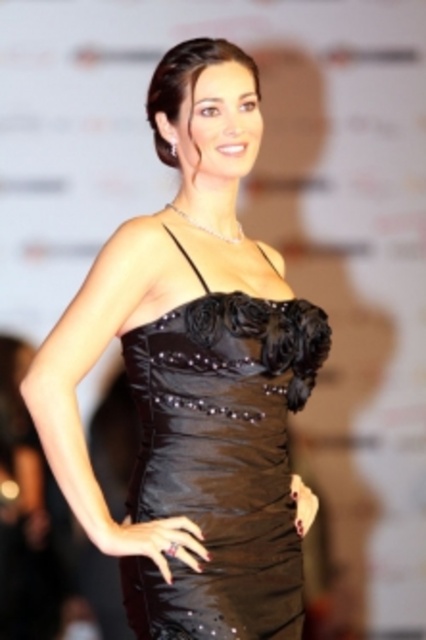
Consider the image. Which is more to the left, shiny satin dress at center or shiny black dress at center?

shiny satin dress at center is more to the left.

Which of these two, shiny satin dress at center or shiny black dress at center, stands shorter?

shiny black dress at center is shorter.

Between point (244, 160) and point (213, 392), which one is positioned behind?

The point (244, 160) is behind.

The image size is (426, 640). Identify the location of shiny satin dress at center. (195, 378).